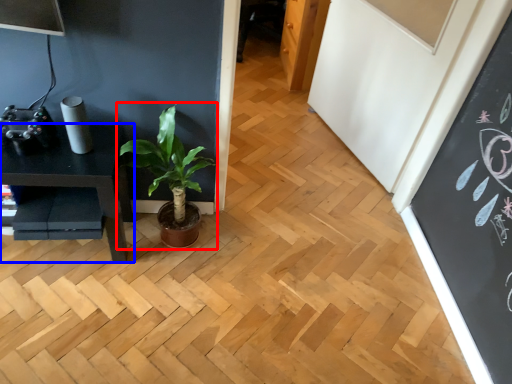
Question: Which of the following is the farthest to the observer, houseplant (highlighted by a red box) or table (highlighted by a blue box)?

Choices:
 (A) houseplant
 (B) table

Answer: (B)